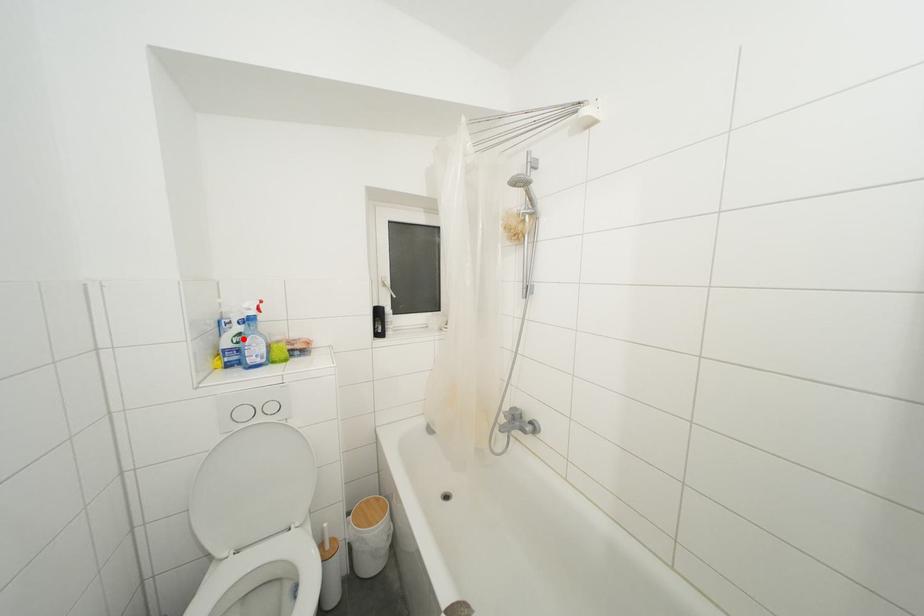
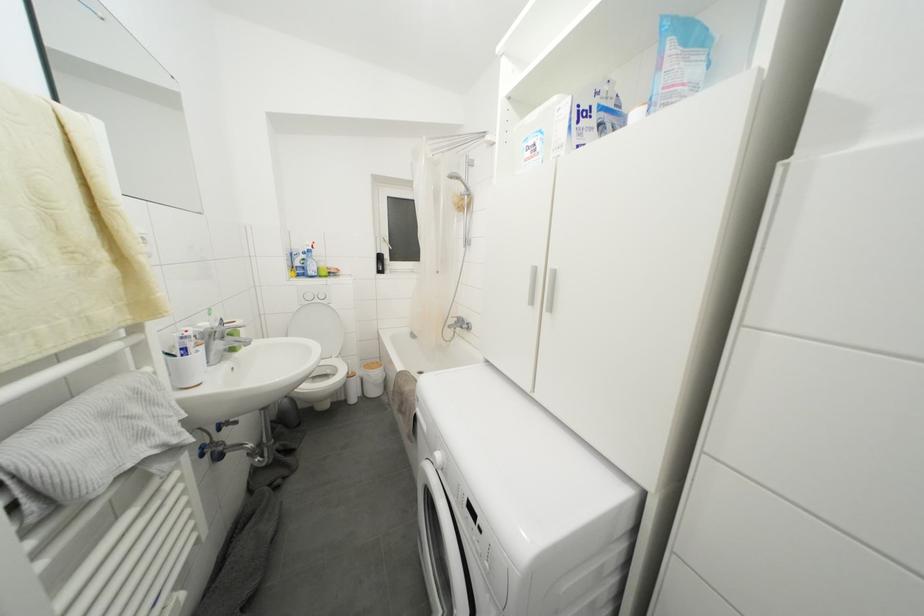
In the second image, find the point that corresponds to the highlighted location in the first image.

(308, 264)